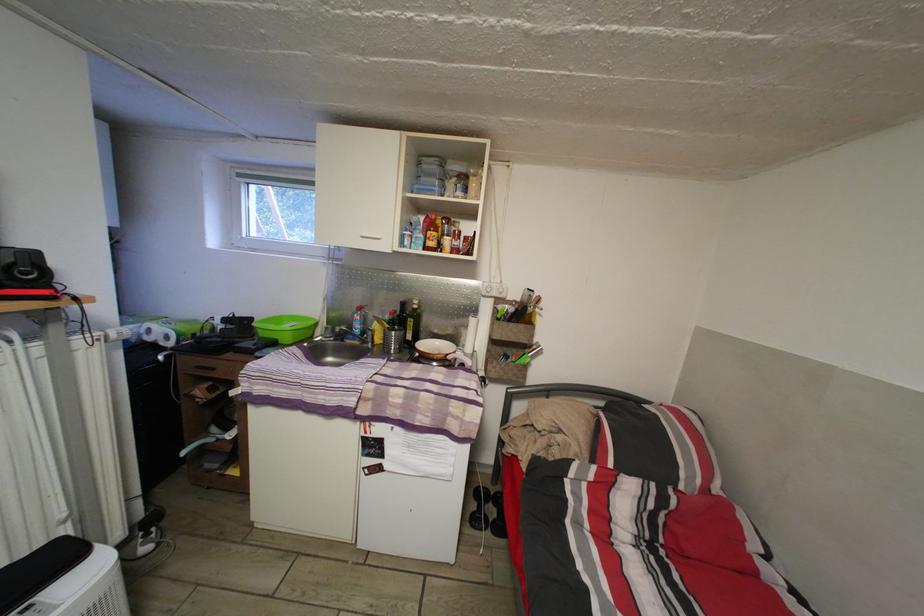
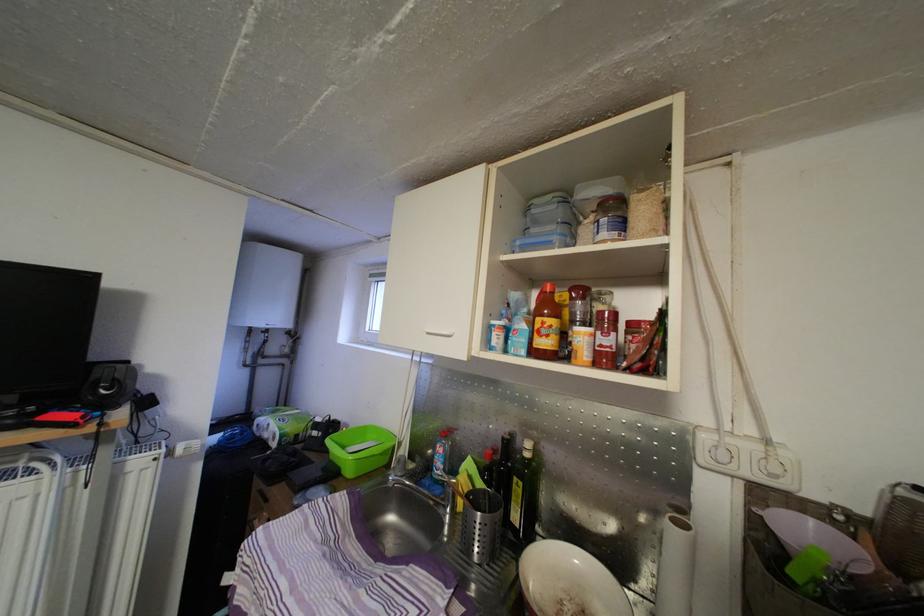
The first image is from the beginning of the video and the second image is from the end. How did the camera likely rotate when shooting the video?

The camera rotated toward left-up.